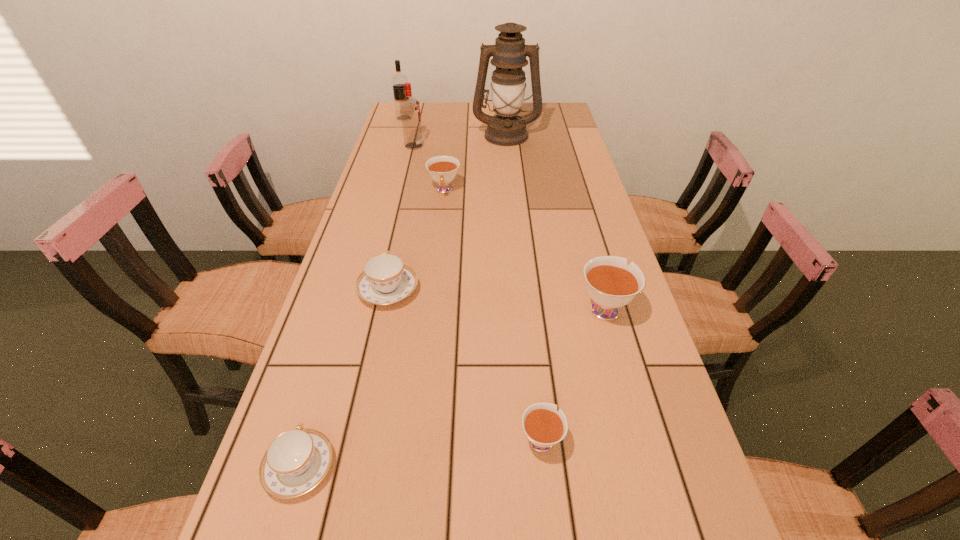
The image size is (960, 540). What are the coordinates of `oil lamp` in the screenshot? It's located at (509, 53).

You are a GUI agent. You are given a task and a screenshot of the screen. Output one action in this format:
    pyautogui.click(x=<x>, y=<y>)
    Task: Click on the brown oil lamp
    The image size is (960, 540).
    Given the screenshot: What is the action you would take?
    pyautogui.click(x=509, y=53)

At what (x,y) coordinates should I click in order to perform the action: click on the farthest object. Please return your answer as a coordinate pair (x, y). This screenshot has width=960, height=540. Looking at the image, I should click on (398, 80).

The image size is (960, 540). I want to click on red vodka, so click(x=409, y=107).

At what (x,y) coordinates should I click in order to perform the action: click on the rightmost teacup. Please return your answer as a coordinate pair (x, y). The width and height of the screenshot is (960, 540). Looking at the image, I should click on (611, 284).

Where is `the tallest teacup`? the tallest teacup is located at coordinates (611, 284).

Find the location of a particular element. Image resolution: width=960 pixels, height=540 pixels. the leftmost white teacup is located at coordinates [443, 169].

The width and height of the screenshot is (960, 540). What are the coordinates of `the fifth nearest object` in the screenshot? It's located at (443, 169).

Find the location of a particular element. the farther blue teacup is located at coordinates (385, 280).

Identify the location of the nearest white teacup. The width and height of the screenshot is (960, 540). pos(544,427).